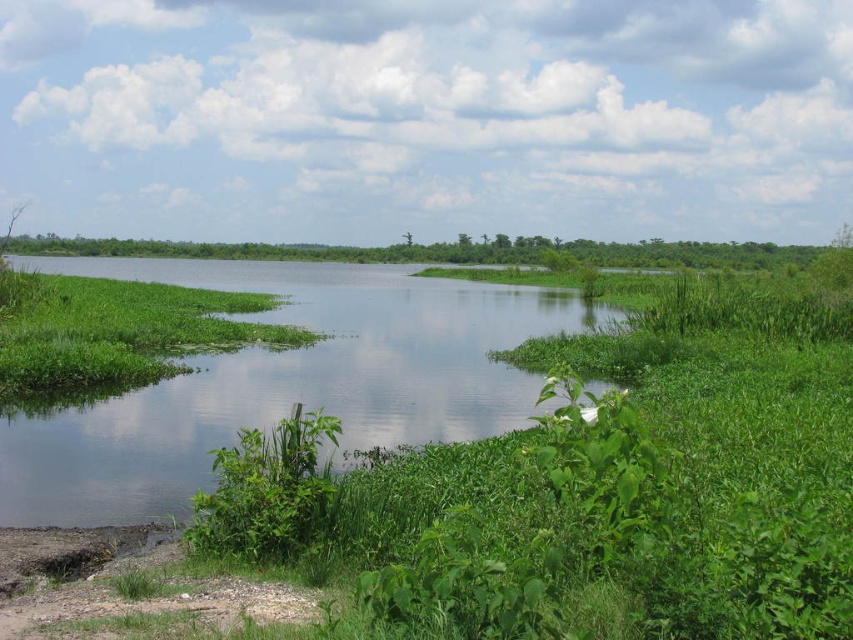
Question: Which point is farther to the camera?

Choices:
 (A) (56, 243)
 (B) (416, 316)

Answer: (A)

Question: Which object is closer to the camera taking this photo?

Choices:
 (A) green grassy land at center
 (B) green grassy river at center

Answer: (B)

Question: Can you confirm if green grassy river at center is positioned to the right of green grassy land at center?

Choices:
 (A) yes
 (B) no

Answer: (B)

Question: Is green grassy river at center bigger than green grassy land at center?

Choices:
 (A) yes
 (B) no

Answer: (B)

Question: Is the position of green grassy river at center less distant than that of green grassy land at center?

Choices:
 (A) yes
 (B) no

Answer: (A)